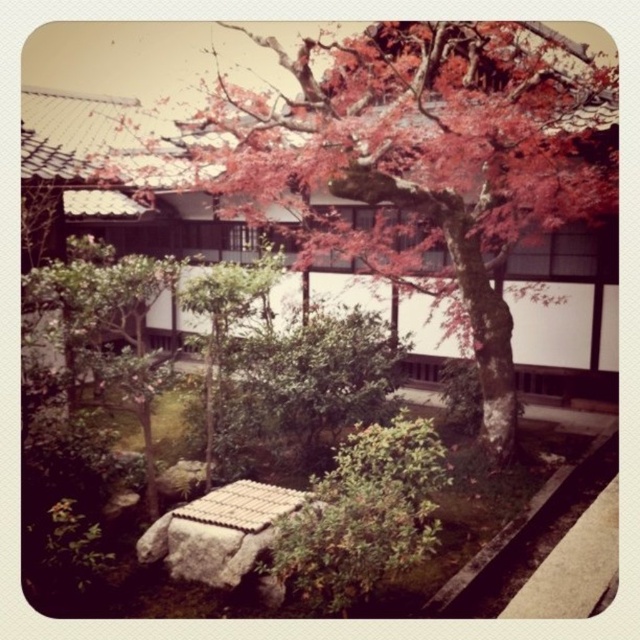
You are standing in the Japanese garden scene. You see a point marked at coordinates (109, 328). What object is located at that point?

The point at coordinates (109, 328) marks a green leafy bush at lower left.

You are planning to plant a new tree in your garden. You observe the smooth bark tree at center and the green leafy bush at center in the Japanese garden scene. Which one is smaller in size?

The smooth bark tree at center is smaller in size compared to the green leafy bush at center.

You are a landscape architect designing a walking path between the smooth bark tree at center and the green leafy bush at lower left. The path must be 2 meters wide. Can the path fit in the space between them?

The distance between the smooth bark tree at center and the green leafy bush at lower left is 7.45 meters. A 2 meter wide path would require at least 2 meters of space, so yes, the path can fit between them since 7.45 meters is greater than 2 meters.